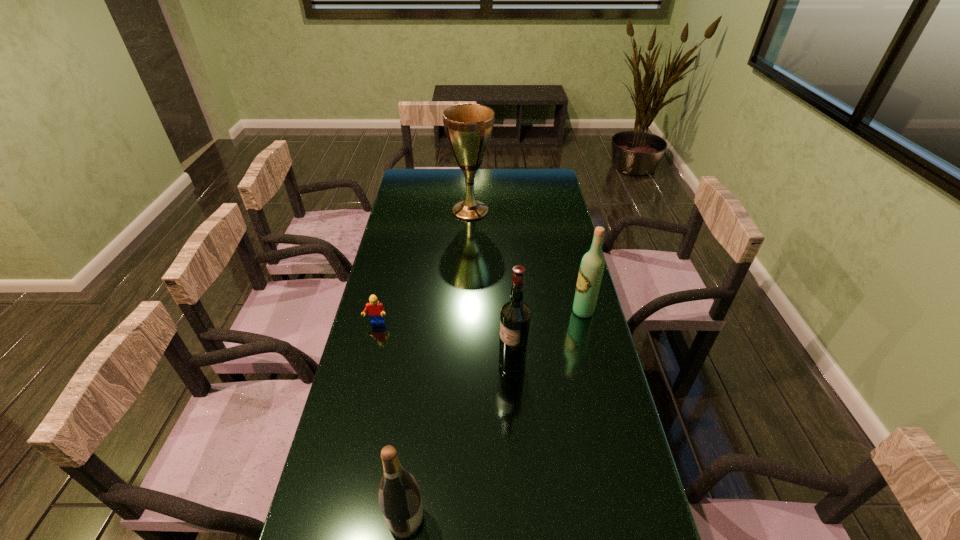
In the image, there is a desktop. Where is `vacant space at the far edge`? vacant space at the far edge is located at coordinates (439, 193).

In the image, there is a desktop. At what (x,y) coordinates should I click in order to perform the action: click on vacant space at the left edge. Please return your answer as a coordinate pair (x, y). Looking at the image, I should click on (352, 375).

Identify the location of vacant space at the right edge of the desktop. (543, 234).

This screenshot has width=960, height=540. I want to click on vacant space at the far left corner, so click(406, 171).

In the image, there is a desktop. In order to click on vacant area at the far right corner in this screenshot , I will do `click(554, 187)`.

Where is `vacant point located between the second wine bottle from left to right and the farthest object`? vacant point located between the second wine bottle from left to right and the farthest object is located at coordinates (492, 288).

Find the location of `free space between the trophy cup and the nearest wine bottle`. free space between the trophy cup and the nearest wine bottle is located at coordinates (438, 365).

What are the coordinates of `blank region between the rightmost object and the leftmost wine bottle` in the screenshot? It's located at (494, 415).

The image size is (960, 540). Find the location of `vacant space in between the second nearest object and the farthest wine bottle`. vacant space in between the second nearest object and the farthest wine bottle is located at coordinates (547, 339).

Find the location of a particular element. The height and width of the screenshot is (540, 960). free space that is in between the second wine bottle from right to left and the rightmost wine bottle is located at coordinates (547, 339).